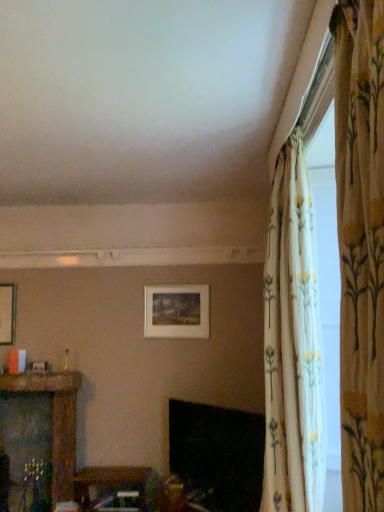
Question: Does floral fabric curtain at upper right, the 2th curtain viewed from the front, appear on the right side of wooden table at lower center, the 2th furniture positioned from the left?

Choices:
 (A) yes
 (B) no

Answer: (A)

Question: Is floral fabric curtain at upper right, the 2th curtain viewed from the front, touching wooden table at lower center, positioned as the first furniture in right-to-left order?

Choices:
 (A) no
 (B) yes

Answer: (A)

Question: From the image's perspective, is floral fabric curtain at upper right, the 2th curtain viewed from the front, on top of wooden table at lower center, positioned as the first furniture in right-to-left order?

Choices:
 (A) no
 (B) yes

Answer: (B)

Question: Are floral fabric curtain at upper right, the 2th curtain viewed from the front, and wooden table at lower center, positioned as the first furniture in right-to-left order, located far from each other?

Choices:
 (A) no
 (B) yes

Answer: (B)

Question: Does floral fabric curtain at upper right, the 2th curtain viewed from the front, have a smaller size compared to wooden table at lower center, the 2th furniture positioned from the left?

Choices:
 (A) no
 (B) yes

Answer: (A)

Question: In terms of height, does matte white picture frame at center look taller or shorter compared to black glossy fireplace at lower center?

Choices:
 (A) short
 (B) tall

Answer: (A)

Question: Looking at their shapes, would you say matte white picture frame at center is wider or thinner than black glossy fireplace at lower center?

Choices:
 (A) wide
 (B) thin

Answer: (B)

Question: From a real-world perspective, is matte white picture frame at center above or below black glossy fireplace at lower center?

Choices:
 (A) below
 (B) above

Answer: (B)

Question: In the image, is matte white picture frame at center positioned in front of or behind black glossy fireplace at lower center?

Choices:
 (A) front
 (B) behind

Answer: (B)

Question: Relative to wooden carved shelf at left, arranged as the 2th furniture when viewed from the right, is floral fabric curtain at right, marked as the first curtain in a front-to-back arrangement, in front or behind?

Choices:
 (A) front
 (B) behind

Answer: (A)

Question: Choose the correct answer: Is floral fabric curtain at right, acting as the 2th curtain starting from the back, inside wooden carved shelf at left, the 1th furniture from the left, or outside it?

Choices:
 (A) outside
 (B) inside

Answer: (A)

Question: In terms of height, does floral fabric curtain at right, marked as the first curtain in a front-to-back arrangement, look taller or shorter compared to wooden carved shelf at left, the 1th furniture from the left?

Choices:
 (A) tall
 (B) short

Answer: (A)

Question: From a real-world perspective, is floral fabric curtain at right, marked as the first curtain in a front-to-back arrangement, physically located above or below wooden carved shelf at left, arranged as the 2th furniture when viewed from the right?

Choices:
 (A) below
 (B) above

Answer: (B)

Question: From the image's perspective, is matte white picture frame at center positioned above or below floral fabric curtain at upper right, the 2th curtain viewed from the front?

Choices:
 (A) below
 (B) above

Answer: (A)

Question: Is matte white picture frame at center taller or shorter than floral fabric curtain at upper right, the 2th curtain viewed from the front?

Choices:
 (A) short
 (B) tall

Answer: (A)